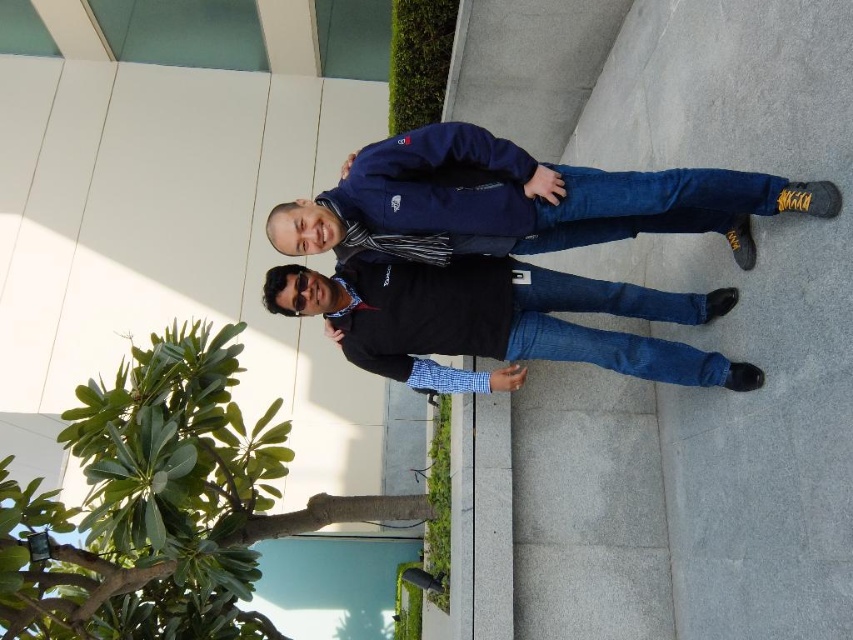
At what (x,y) coordinates should I click in order to perform the action: click on navy blue fleece jacket at upper center. Please return your answer as a coordinate pair (x, y). This screenshot has width=853, height=640. Looking at the image, I should click on (517, 200).

Is point (439, 177) positioned before point (560, 332)?

Yes, point (439, 177) is in front of point (560, 332).

I want to click on navy blue fleece jacket at upper center, so click(517, 200).